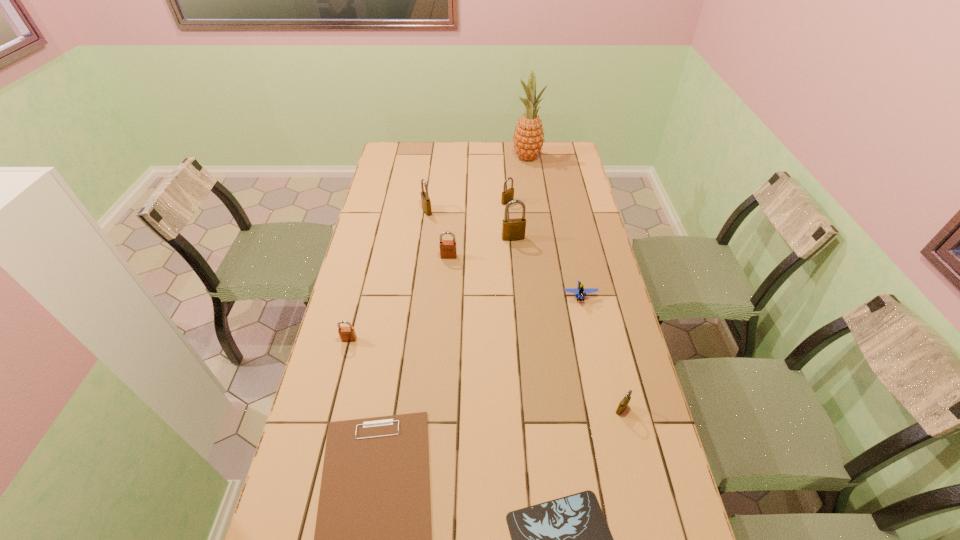
Locate an element on the screen. The height and width of the screenshot is (540, 960). pineapple is located at coordinates (528, 139).

What are the coordinates of `the tallest object` in the screenshot? It's located at (528, 139).

At what (x,y) coordinates should I click in order to perform the action: click on the third farthest brass padlock. Please return your answer as a coordinate pair (x, y). Looking at the image, I should click on (512, 229).

Identify the location of the second tallest object. This screenshot has height=540, width=960. (512, 229).

Locate an element on the screen. This screenshot has height=540, width=960. the leftmost brass padlock is located at coordinates (426, 202).

Where is `the second tallest padlock`? the second tallest padlock is located at coordinates (426, 202).

This screenshot has height=540, width=960. What are the coordinates of `the fourth padlock from right to left` in the screenshot? It's located at (448, 250).

Where is `the bigger brown padlock`? This screenshot has width=960, height=540. the bigger brown padlock is located at coordinates (448, 250).

You are a GUI agent. You are given a task and a screenshot of the screen. Output one action in this format:
    pyautogui.click(x=<x>, y=<y>)
    Task: Click on the farthest brass padlock
    The image size is (960, 540).
    Given the screenshot: What is the action you would take?
    pyautogui.click(x=507, y=195)

Where is `the third biggest brass padlock`? the third biggest brass padlock is located at coordinates (507, 195).